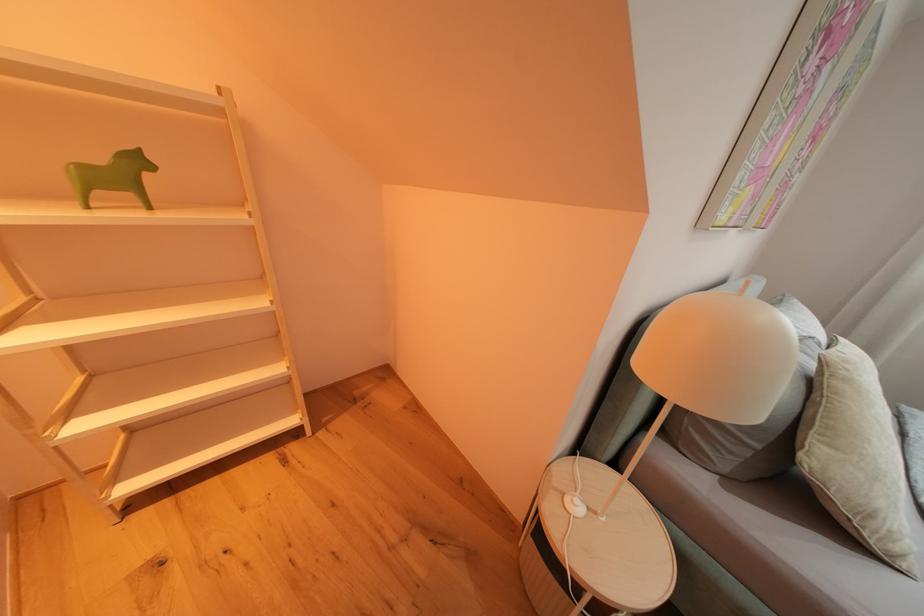
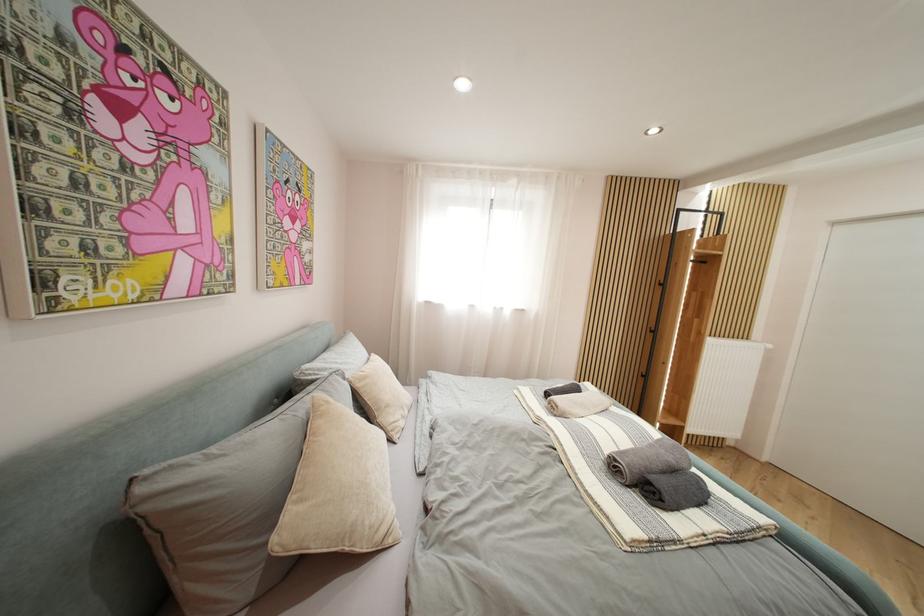
Question: The camera is either moving clockwise (left) or counter-clockwise (right) around the object. The first image is from the beginning of the video and the second image is from the end. Is the camera moving left or right when shooting the video?

Choices:
 (A) Left
 (B) Right

Answer: (A)